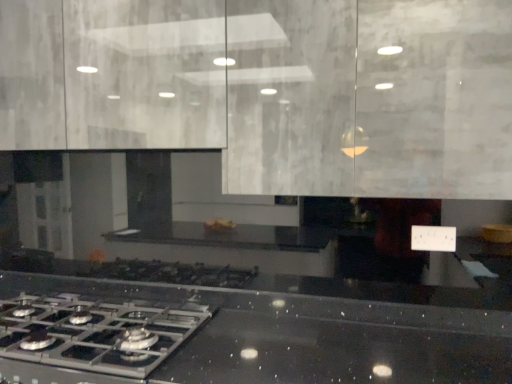
In order to face polished stainless steel gas stove at lower left, should I rotate leftwards or rightwards?

You should look left and rotate roughly 23.015 degrees.

Image resolution: width=512 pixels, height=384 pixels. Identify the location of polished stainless steel gas stove at lower left. (95, 333).

Describe the element at coordinates (95, 333) in the screenshot. I see `polished stainless steel gas stove at lower left` at that location.

This screenshot has height=384, width=512. I want to click on polished stainless steel gas stove at lower left, so click(95, 333).